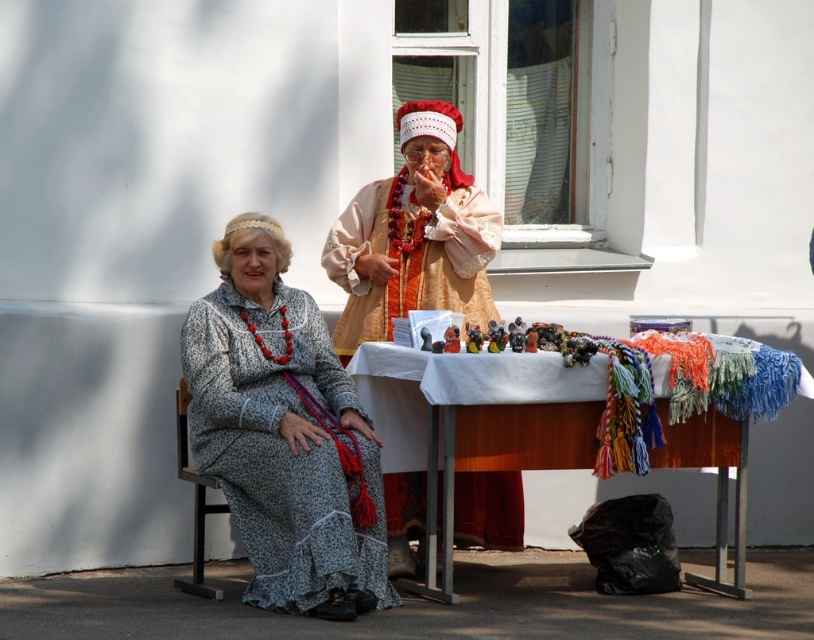
Question: Is printed fabric dress at center further to camera compared to matte orange fabric robe at center?

Choices:
 (A) yes
 (B) no

Answer: (B)

Question: Does printed fabric dress at center appear under matte orange fabric robe at center?

Choices:
 (A) no
 (B) yes

Answer: (B)

Question: Among these points, which one is nearest to the camera?

Choices:
 (A) (484, 308)
 (B) (447, 358)

Answer: (B)

Question: Considering the relative positions of printed fabric dress at center and white cloth-covered table at center in the image provided, where is printed fabric dress at center located with respect to white cloth-covered table at center?

Choices:
 (A) right
 (B) left

Answer: (B)

Question: Which of these objects is positioned farthest from the matte orange fabric robe at center?

Choices:
 (A) white cloth-covered table at center
 (B) printed fabric dress at center

Answer: (B)

Question: Which of the following is the farthest from the observer?

Choices:
 (A) tap(272, 435)
 (B) tap(580, 440)
 (C) tap(492, 228)

Answer: (C)